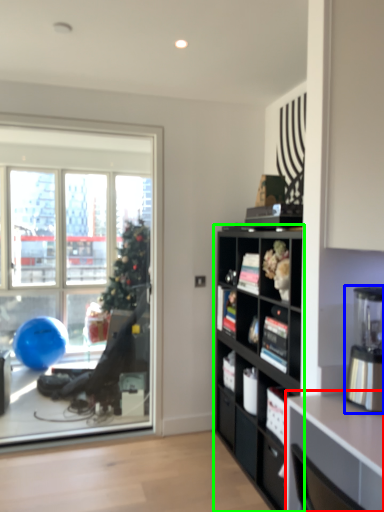
Question: Based on their relative distances, which object is farther from desk (highlighted by a red box)? Choose from coffee machine (highlighted by a blue box) and cabinetry (highlighted by a green box).

Choices:
 (A) coffee machine
 (B) cabinetry

Answer: (B)